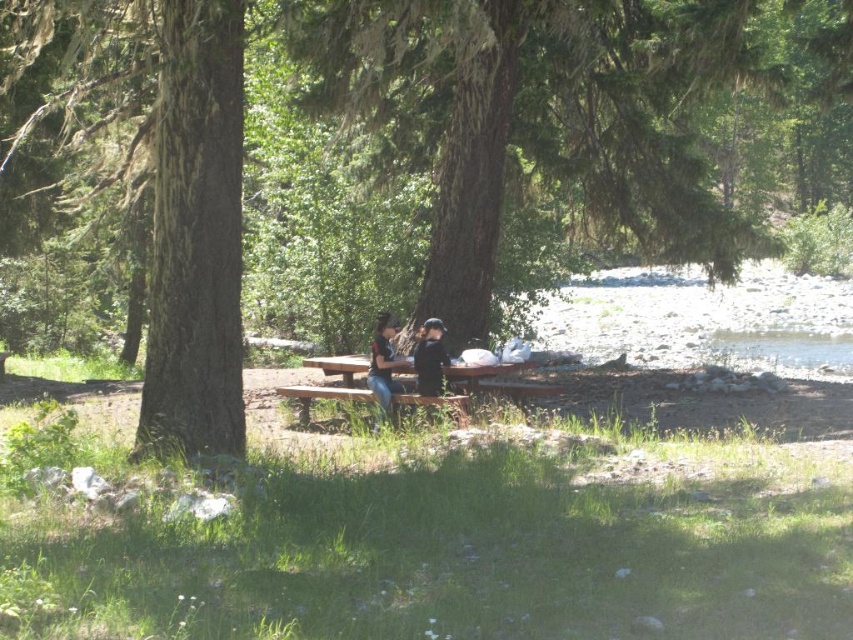
Question: Which object appears closest to the camera in this image?

Choices:
 (A) green mossy tree trunk at center
 (B) brown wooden bench at center
 (C) matte black shirts at center
 (D) green rough bark tree at center

Answer: (A)

Question: Which point appears farthest from the camera in this image?

Choices:
 (A) (434, 328)
 (B) (401, 392)
 (C) (172, 312)

Answer: (B)

Question: Can you confirm if green rough bark tree at center is positioned above green mossy tree trunk at center?

Choices:
 (A) yes
 (B) no

Answer: (A)

Question: Which is nearer to the green rough bark tree at center?

Choices:
 (A) brown wooden bench at center
 (B) matte black shirts at center
 (C) green mossy tree trunk at center

Answer: (C)

Question: Observing the image, what is the correct spatial positioning of matte black shirts at center in reference to brown wooden bench at center?

Choices:
 (A) left
 (B) right

Answer: (B)

Question: Is green mossy tree trunk at center to the left of matte black shirts at center from the viewer's perspective?

Choices:
 (A) no
 (B) yes

Answer: (B)